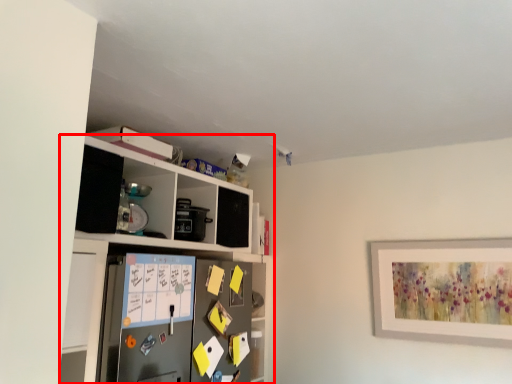
Question: From the image's perspective, where is shelf (annotated by the red box) located in relation to appliance in the image?

Choices:
 (A) below
 (B) above

Answer: (B)